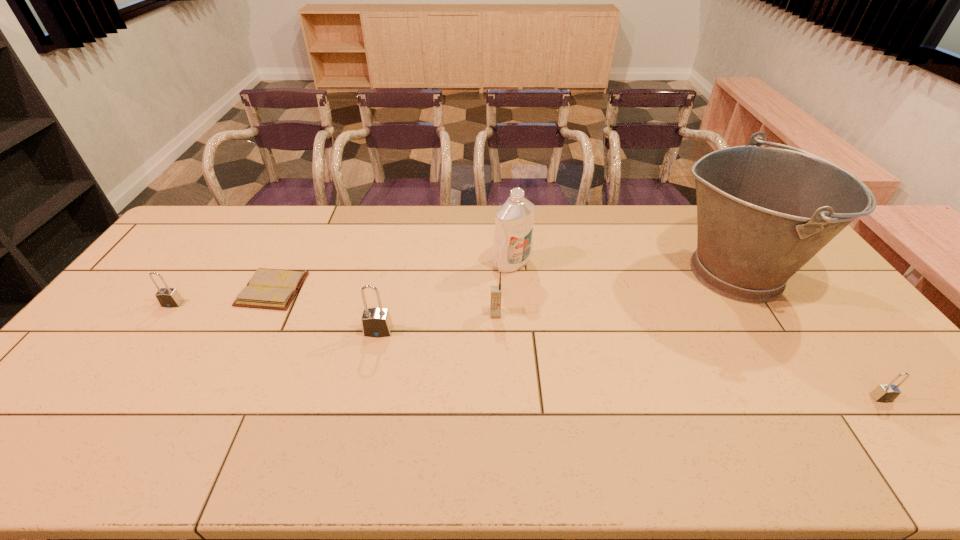
In order to click on padlock that is at the right edge in this screenshot , I will do coord(884,393).

This screenshot has width=960, height=540. In order to click on bucket that is at the right edge in this screenshot , I will do `click(763, 212)`.

The height and width of the screenshot is (540, 960). What are the coordinates of `object that is at the far right corner` in the screenshot? It's located at (763, 212).

This screenshot has width=960, height=540. Identify the location of object at the near right corner. (884, 393).

The image size is (960, 540). Identify the location of free space at the far edge of the desktop. (585, 231).

Where is `vacant area at the right edge`? This screenshot has width=960, height=540. vacant area at the right edge is located at coordinates (820, 299).

The width and height of the screenshot is (960, 540). In order to click on vacant point located between the shortest padlock and the detergent in this screenshot , I will do `click(696, 330)`.

The height and width of the screenshot is (540, 960). What are the coordinates of `vacant area between the fifth tallest object and the tallest object` in the screenshot? It's located at (453, 288).

Identify the location of vacant space that's between the bucket and the nearest padlock. (807, 335).

What are the coordinates of `empty location between the second farthest padlock and the tallest object` in the screenshot? It's located at click(557, 302).